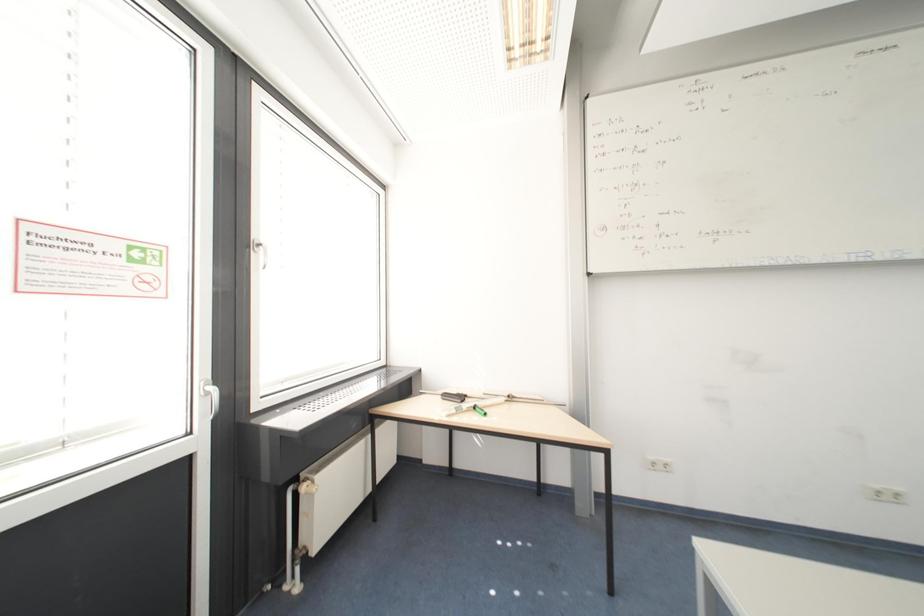
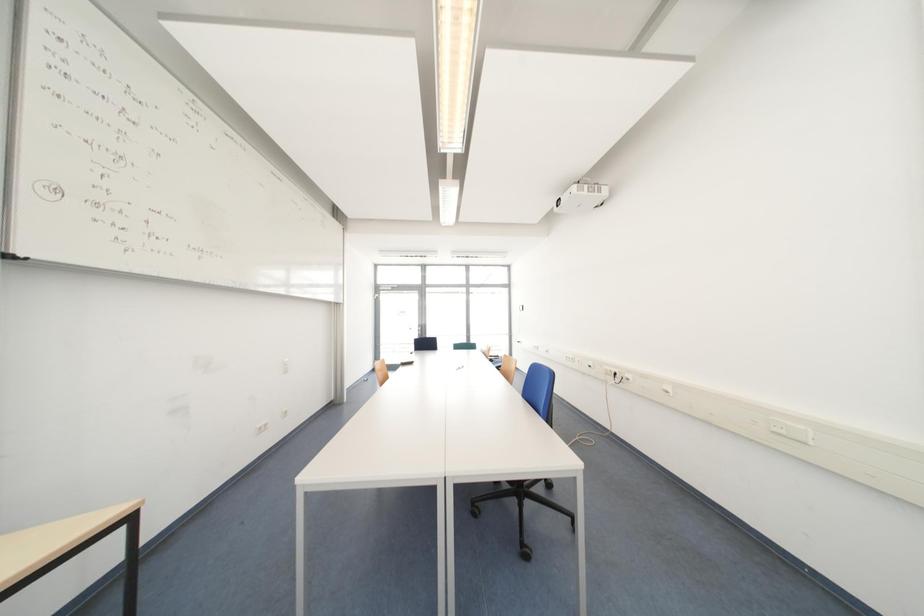
Question: How did the camera likely rotate?

Choices:
 (A) Left
 (B) Right
 (C) Up
 (D) Down

Answer: (B)